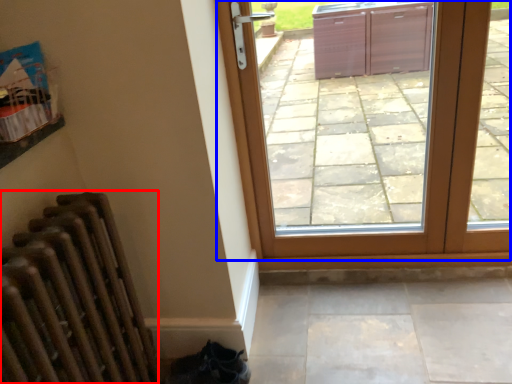
Question: Which point is closer to the camera, radiator (highlighted by a red box) or door (highlighted by a blue box)?

Choices:
 (A) radiator
 (B) door

Answer: (A)